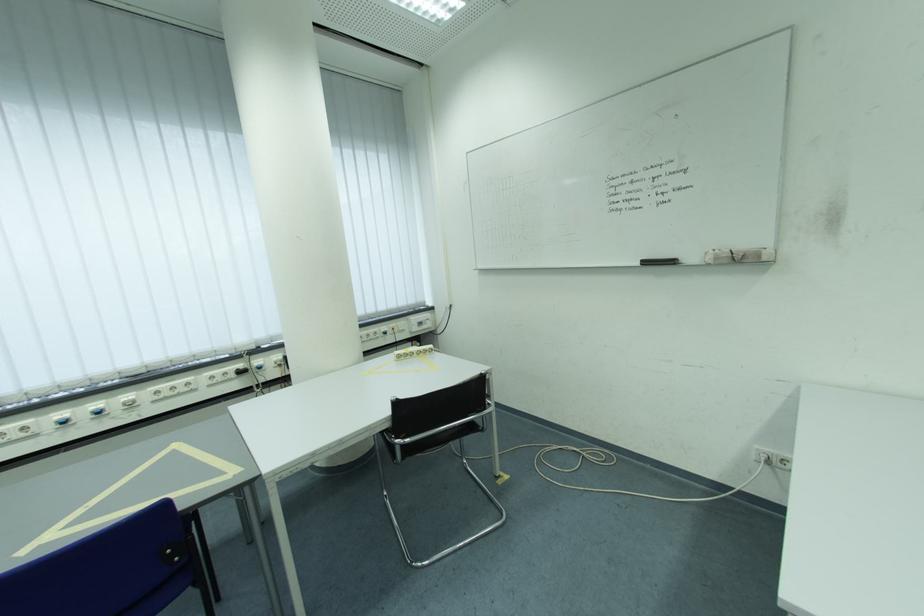
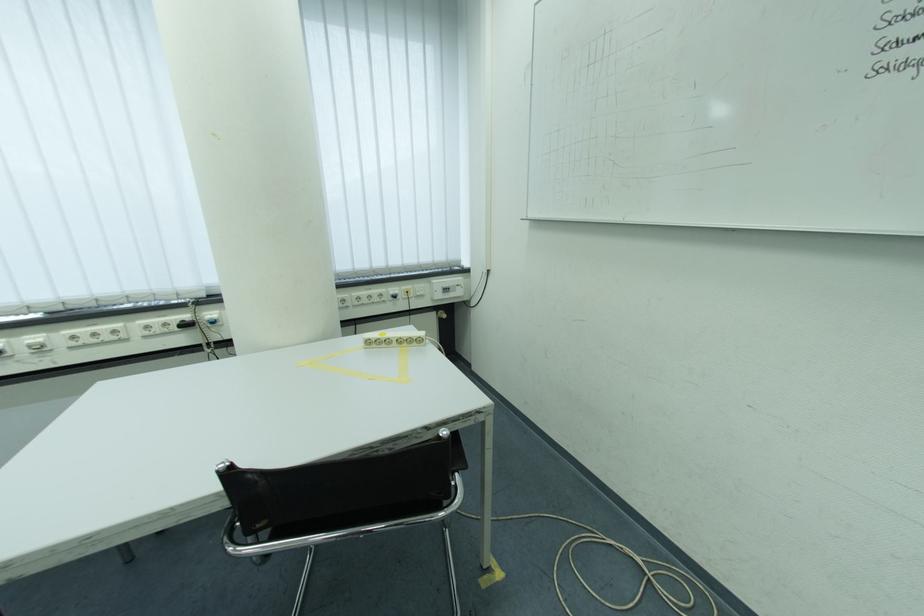
Question: What movement of the cameraman would produce the second image?

Choices:
 (A) Left
 (B) Right
 (C) Forward
 (D) Backward

Answer: (C)